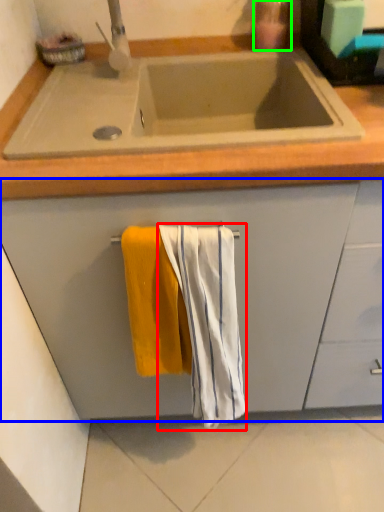
Question: Estimate the real-world distances between objects in this image. Which object is closer to beach towel (highlighted by a red box), cabinetry (highlighted by a blue box) or soap dispenser (highlighted by a green box)?

Choices:
 (A) cabinetry
 (B) soap dispenser

Answer: (A)